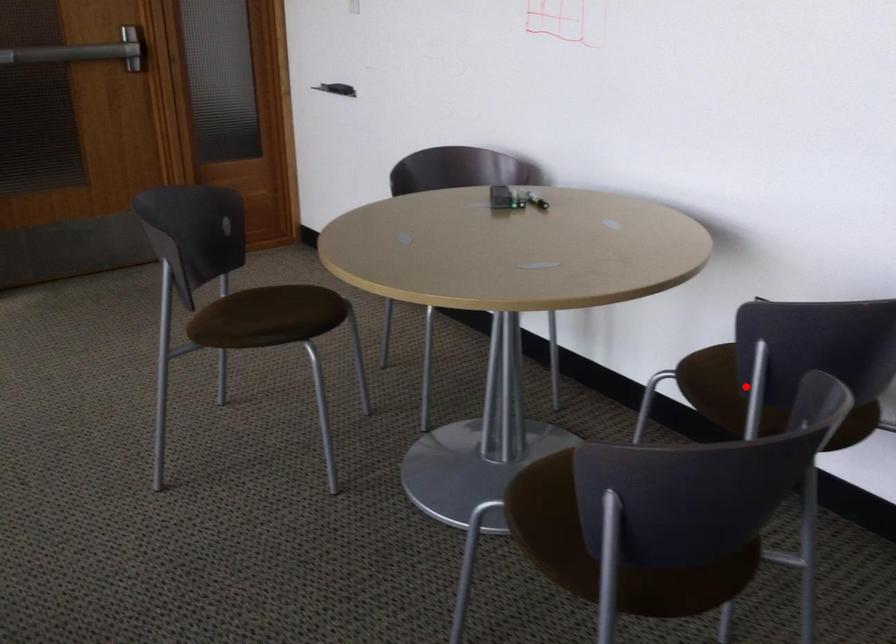
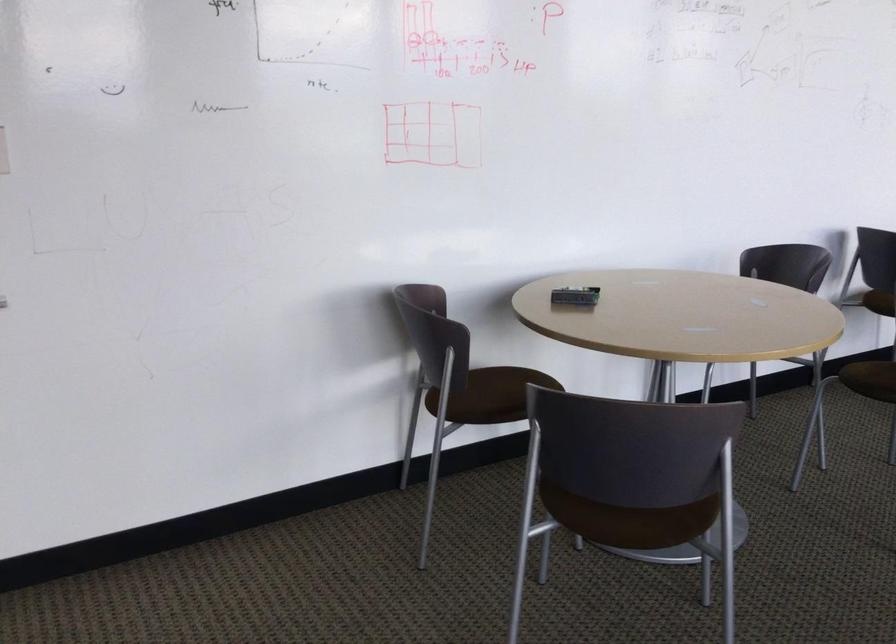
Question: I am providing you with two images of the same scene from different viewpoints. A red point is marked on the first image. Is the red point's position out of view in image 2?

Choices:
 (A) Yes
 (B) No

Answer: (A)